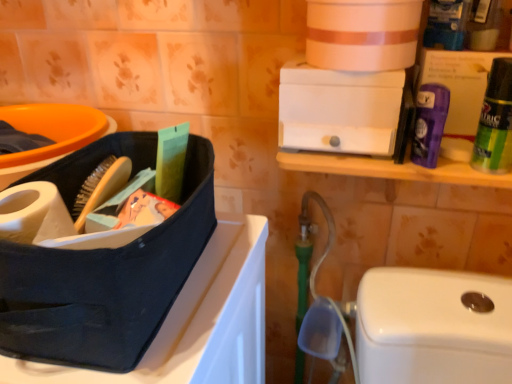
Question: Is matte black lunch box at left to the right of green matte fabric softener at upper right, the 2th cleaning product positioned from the left, from the viewer's perspective?

Choices:
 (A) yes
 (B) no

Answer: (B)

Question: Is matte black lunch box at left bigger than green matte fabric softener at upper right, positioned as the first cleaning product in right-to-left order?

Choices:
 (A) yes
 (B) no

Answer: (A)

Question: Can green matte fabric softener at upper right, positioned as the first cleaning product in right-to-left order, be found inside matte black lunch box at left?

Choices:
 (A) yes
 (B) no

Answer: (B)

Question: From the image's perspective, is matte black lunch box at left located beneath green matte fabric softener at upper right, the 2th cleaning product positioned from the left?

Choices:
 (A) yes
 (B) no

Answer: (A)

Question: Does matte black lunch box at left have a greater height compared to green matte fabric softener at upper right, the 2th cleaning product positioned from the left?

Choices:
 (A) yes
 (B) no

Answer: (A)

Question: Is purple matte deodorant at upper right, positioned as the 2th cleaning product in right-to-left order, spatially inside green matte fabric softener at upper right, positioned as the first cleaning product in right-to-left order, or outside of it?

Choices:
 (A) inside
 (B) outside

Answer: (B)

Question: Considering their positions, is purple matte deodorant at upper right, positioned as the 2th cleaning product in right-to-left order, located in front of or behind green matte fabric softener at upper right, positioned as the first cleaning product in right-to-left order?

Choices:
 (A) behind
 (B) front

Answer: (A)

Question: From a real-world perspective, relative to green matte fabric softener at upper right, positioned as the first cleaning product in right-to-left order, is purple matte deodorant at upper right, positioned as the 2th cleaning product in right-to-left order, vertically above or below?

Choices:
 (A) above
 (B) below

Answer: (B)

Question: Considering the positions of purple matte deodorant at upper right, which is the 1th cleaning product from left to right, and green matte fabric softener at upper right, positioned as the first cleaning product in right-to-left order, in the image, is purple matte deodorant at upper right, which is the 1th cleaning product from left to right, bigger or smaller than green matte fabric softener at upper right, positioned as the first cleaning product in right-to-left order,?

Choices:
 (A) small
 (B) big

Answer: (A)

Question: From the image's perspective, is white plastic drawer at upper center above or below purple matte deodorant at upper right, which is the 1th cleaning product from left to right?

Choices:
 (A) above
 (B) below

Answer: (A)

Question: Choose the correct answer: Is white plastic drawer at upper center inside purple matte deodorant at upper right, which is the 1th cleaning product from left to right, or outside it?

Choices:
 (A) inside
 (B) outside

Answer: (B)

Question: Is white plastic drawer at upper center bigger or smaller than purple matte deodorant at upper right, which is the 1th cleaning product from left to right?

Choices:
 (A) big
 (B) small

Answer: (A)

Question: In terms of width, does white plastic drawer at upper center look wider or thinner when compared to purple matte deodorant at upper right, positioned as the 2th cleaning product in right-to-left order?

Choices:
 (A) wide
 (B) thin

Answer: (A)

Question: Considering the positions of matte black lunch box at left and purple matte deodorant at upper right in the image, is matte black lunch box at left bigger or smaller than purple matte deodorant at upper right?

Choices:
 (A) small
 (B) big

Answer: (B)

Question: From their relative heights in the image, would you say matte black lunch box at left is taller or shorter than purple matte deodorant at upper right?

Choices:
 (A) short
 (B) tall

Answer: (B)